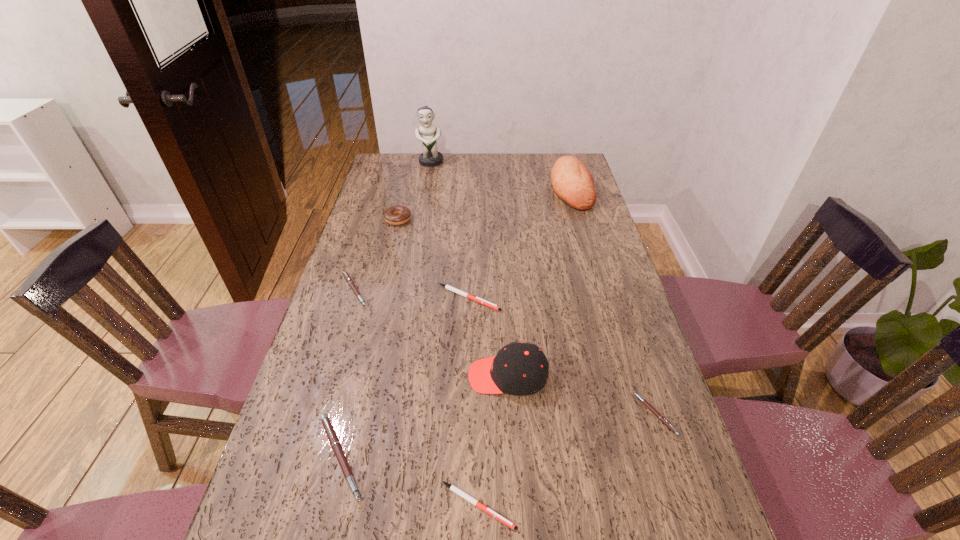
Locate which white pen ranks in proximity to the doughnut. Please provide its 2D coordinates. Your answer should be formatted as a tuple, i.e. [(x, y)], where the tuple contains the x and y coordinates of a point satisfying the conditions above.

[(477, 299)]